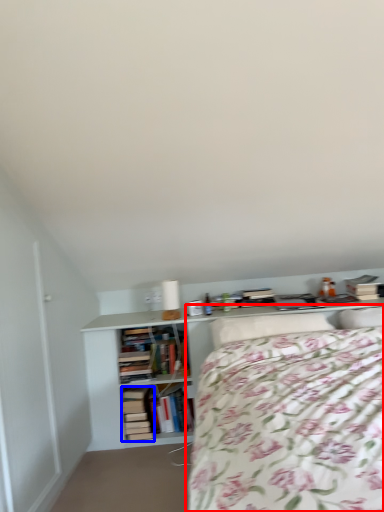
Question: Which object appears closest to the camera in this image, bed (highlighted by a red box) or book (highlighted by a blue box)?

Choices:
 (A) bed
 (B) book

Answer: (A)